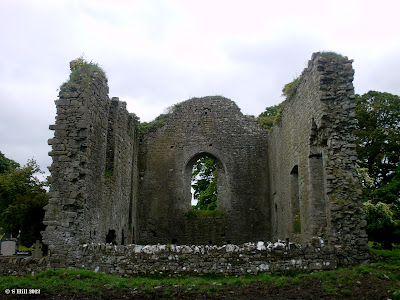
Where is `window`? This screenshot has width=400, height=300. window is located at coordinates (203, 152).